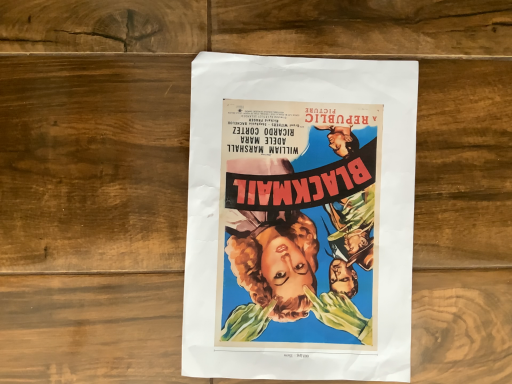
Measure the distance between vibrant paper poster at center and camera.

38.25 centimeters.

Measure the distance between point [245,336] and camera.

15.31 inches.

Describe the element at coordinates (300, 218) in the screenshot. I see `vibrant paper poster at center` at that location.

Where is `vibrant paper poster at center`? The height and width of the screenshot is (384, 512). vibrant paper poster at center is located at coordinates (300, 218).

The image size is (512, 384). I want to click on vibrant paper poster at center, so click(x=300, y=218).